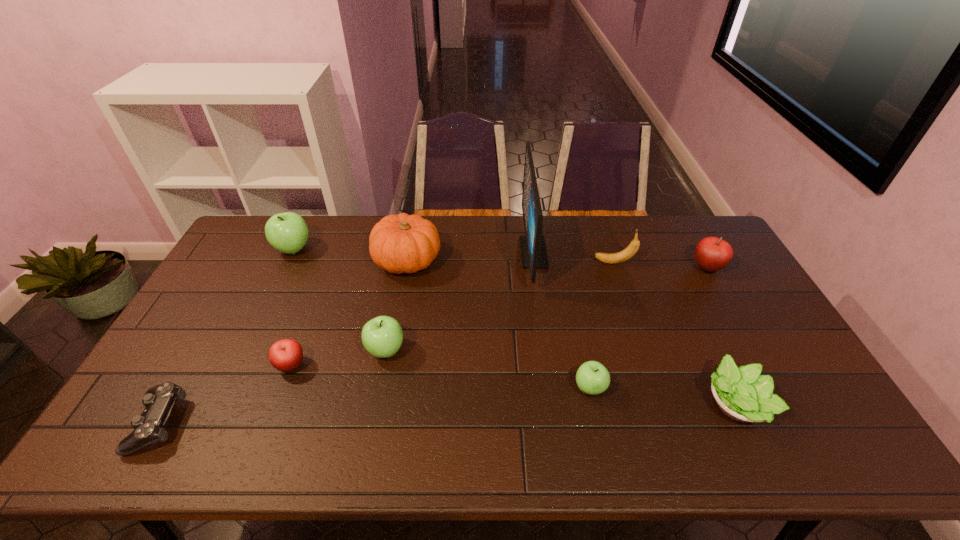
Identify the location of computer monitor. Image resolution: width=960 pixels, height=540 pixels. (533, 251).

Where is `the sixth object from left to right`? The width and height of the screenshot is (960, 540). the sixth object from left to right is located at coordinates (533, 251).

You are a GUI agent. You are given a task and a screenshot of the screen. Output one action in this format:
    pyautogui.click(x=<x>, y=<y>)
    Task: Click on the orange pumpkin
    
    Given the screenshot: What is the action you would take?
    pyautogui.click(x=402, y=243)

You are a GUI agent. You are given a task and a screenshot of the screen. Output one action in this format:
    pyautogui.click(x=<x>, y=<y>)
    Task: Click on the leftmost apple
    This screenshot has width=960, height=540.
    Given the screenshot: What is the action you would take?
    pyautogui.click(x=287, y=232)

Where is `the tallest apple`? The image size is (960, 540). the tallest apple is located at coordinates (287, 232).

Locate an element on the screen. This screenshot has height=540, width=960. banana is located at coordinates (611, 258).

Image resolution: width=960 pixels, height=540 pixels. Find the location of `the eighth object from left to right`. the eighth object from left to right is located at coordinates (611, 258).

Where is `the farther red apple`? This screenshot has height=540, width=960. the farther red apple is located at coordinates (712, 254).

Where is `the right red apple`? The image size is (960, 540). the right red apple is located at coordinates (712, 254).

The width and height of the screenshot is (960, 540). I want to click on the third apple from right to left, so click(382, 336).